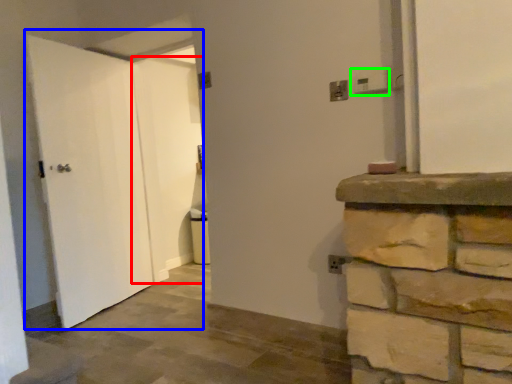
Question: Based on their relative distances, which object is nearer to door (highlighted by a red box)? Choose from door (highlighted by a blue box) and electric outlet (highlighted by a green box).

Choices:
 (A) door
 (B) electric outlet

Answer: (A)